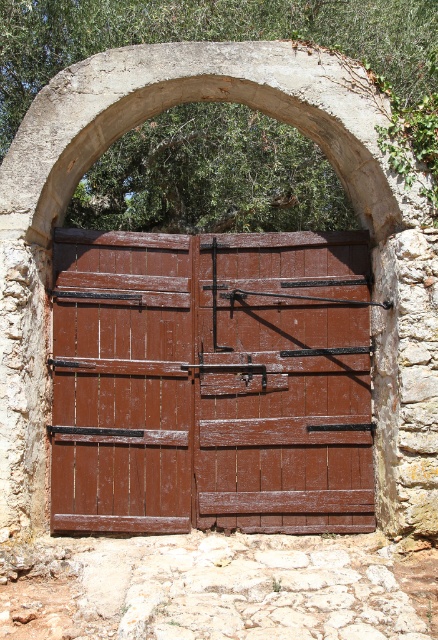
Question: Can you confirm if brown wooden gate at center is bigger than wooden gate at center?

Choices:
 (A) yes
 (B) no

Answer: (A)

Question: Is brown wooden gate at center below wooden gate at center?

Choices:
 (A) no
 (B) yes

Answer: (A)

Question: Which point appears farthest from the camera in this image?

Choices:
 (A) pyautogui.click(x=80, y=360)
 (B) pyautogui.click(x=310, y=512)

Answer: (A)

Question: Does brown wooden gate at center come behind wooden gate at center?

Choices:
 (A) no
 (B) yes

Answer: (A)

Question: Among these points, which one is farthest from the camera?

Choices:
 (A) (142, 253)
 (B) (71, 317)

Answer: (A)